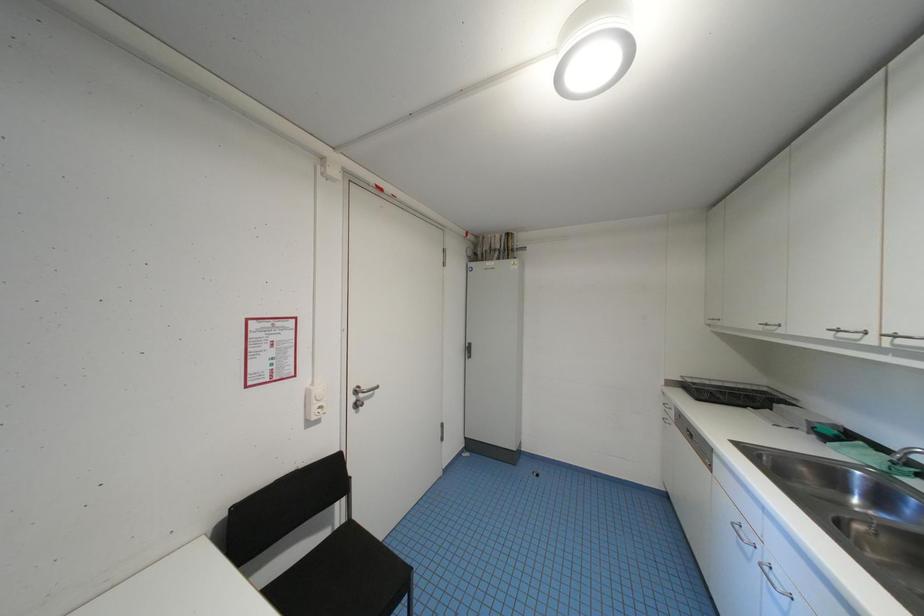
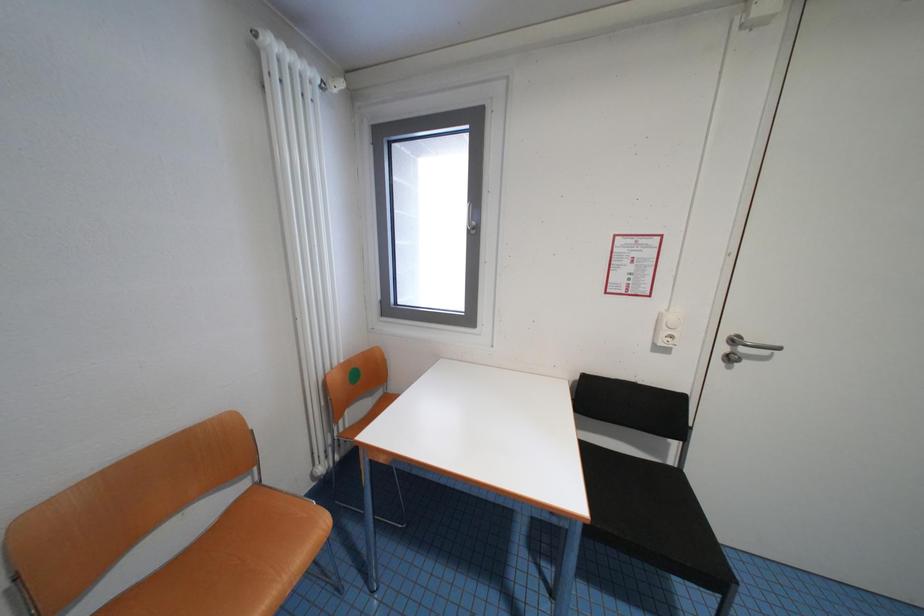
Question: The camera is either moving clockwise (left) or counter-clockwise (right) around the object. The first image is from the beginning of the video and the second image is from the end. Is the camera moving left or right when shooting the video?

Choices:
 (A) Left
 (B) Right

Answer: (B)